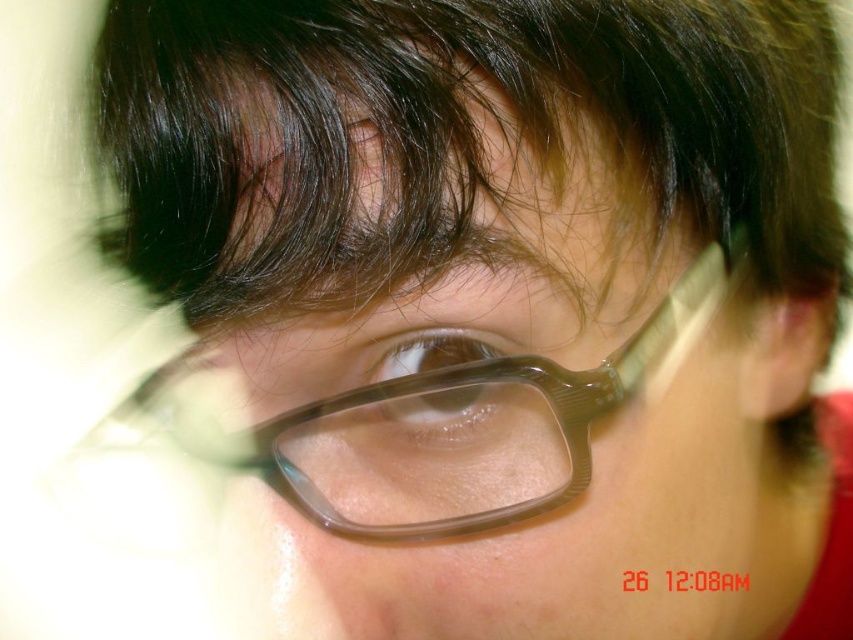
Question: Which point appears closest to the camera in this image?

Choices:
 (A) (321, 513)
 (B) (451, 10)

Answer: (B)

Question: Is translucent plastic bangs at upper center bigger than translucent plastic eye at center?

Choices:
 (A) no
 (B) yes

Answer: (B)

Question: Can you confirm if translucent plastic bangs at upper center is positioned to the right of transparent plastic glasses at center?

Choices:
 (A) yes
 (B) no

Answer: (A)

Question: Which object is positioned closest to the translucent plastic eye at center?

Choices:
 (A) transparent plastic glasses at center
 (B) translucent plastic bangs at upper center

Answer: (A)

Question: Is transparent plastic glasses at center thinner than translucent plastic eye at center?

Choices:
 (A) yes
 (B) no

Answer: (B)

Question: Which point appears farthest from the camera in this image?

Choices:
 (A) (509, 388)
 (B) (180, 92)

Answer: (A)